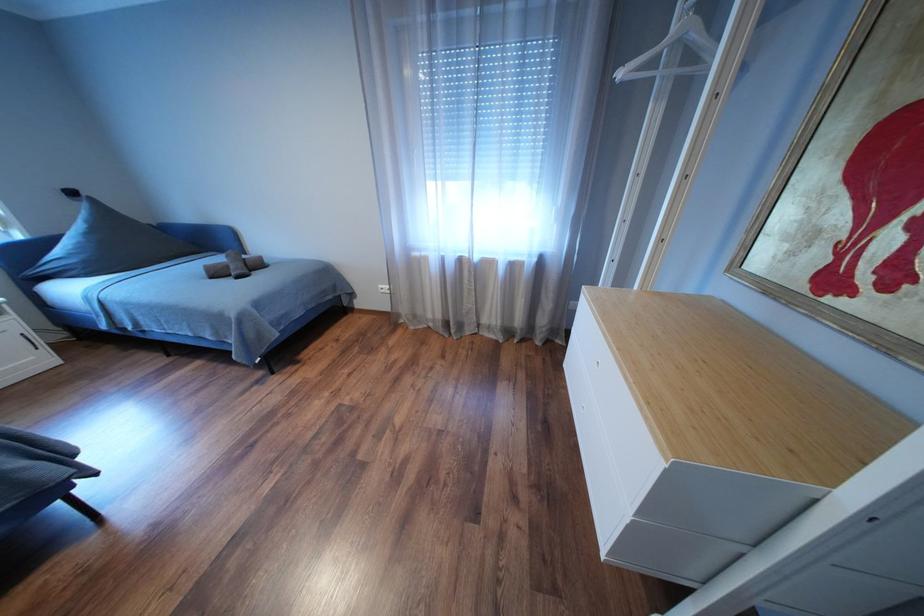
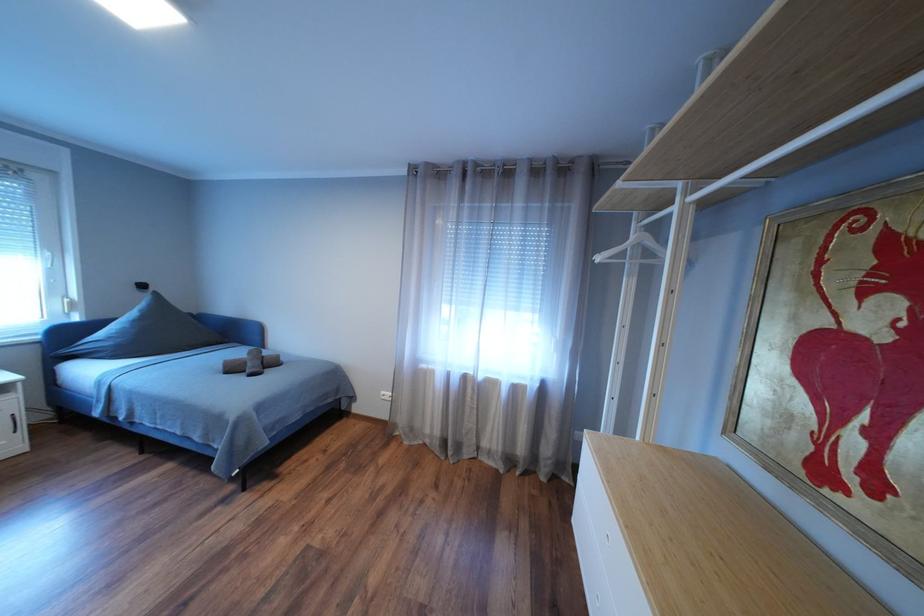
Question: The images are taken continuously from a first-person perspective. In which direction is your viewpoint rotating?

Choices:
 (A) Left
 (B) Right
 (C) Up
 (D) Down

Answer: (C)